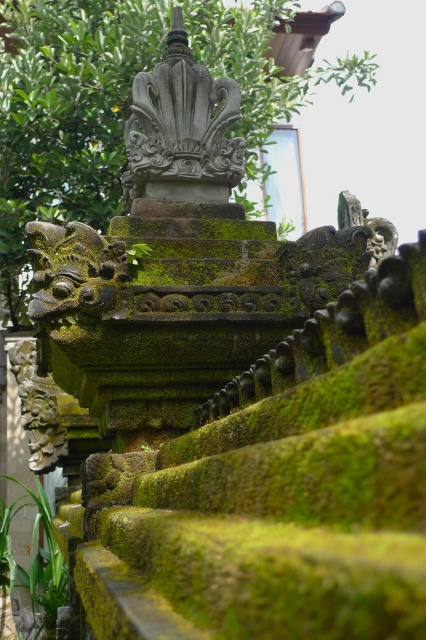
You are an architect examining the stone structure. You notice the green mossy stone at center and the gray stone sculpture at center. Which one has a larger size?

The green mossy stone at center is bigger than the gray stone sculpture at center.

You are an architect examining the stone structure. You notice the green mossy stone at center and the gray stone sculpture at center. Which one is positioned higher in the structure?

The green mossy stone at center is positioned higher than the gray stone sculpture at center, as it is located above it.

You are an architect examining the stone structure. You notice the green mossy stone at center and the gray stone sculpture at center. Which object is closer to you from your current viewpoint?

The green mossy stone at center is closer to you because the gray stone sculpture at center is positioned behind it.